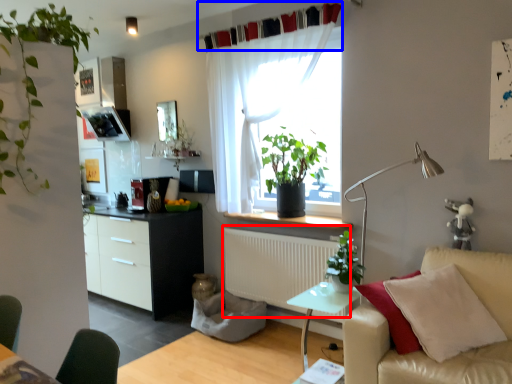
Question: Which of the following is the closest to the observer, radiator (highlighted by a red box) or curtain (highlighted by a blue box)?

Choices:
 (A) radiator
 (B) curtain

Answer: (B)